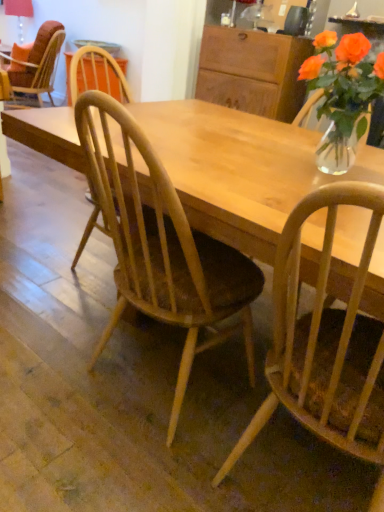
Question: Is the position of wooden cabinet at upper center less distant than that of natural wood chair at center, arranged as the third chair when viewed from the top?

Choices:
 (A) yes
 (B) no

Answer: (B)

Question: Is wooden cabinet at upper center taller than natural wood chair at center, positioned as the first chair in bottom-to-top order?

Choices:
 (A) no
 (B) yes

Answer: (A)

Question: Is wooden cabinet at upper center next to natural wood chair at center, positioned as the first chair in bottom-to-top order?

Choices:
 (A) no
 (B) yes

Answer: (A)

Question: Is wooden cabinet at upper center turned away from natural wood chair at center, positioned as the first chair in bottom-to-top order?

Choices:
 (A) no
 (B) yes

Answer: (A)

Question: Is wooden cabinet at upper center not close to natural wood chair at center, placed as the 3th chair when sorted from left to right?

Choices:
 (A) yes
 (B) no

Answer: (A)

Question: Is natural wood chair at center, positioned as the first chair in bottom-to-top order, inside wooden cabinet at upper center?

Choices:
 (A) no
 (B) yes

Answer: (A)

Question: From a real-world perspective, is light wood chair at center, placed as the 2th chair when sorted from left to right, under natural wood chair at center, placed as the 3th chair when sorted from left to right?

Choices:
 (A) yes
 (B) no

Answer: (B)

Question: Is light wood chair at center, which is the 2th chair in front-to-back order, looking in the opposite direction of natural wood chair at center, placed as the third chair when sorted from back to front?

Choices:
 (A) no
 (B) yes

Answer: (A)

Question: From a real-world perspective, is light wood chair at center, arranged as the 2th chair when viewed from the right, on top of natural wood chair at center, placed as the 3th chair when sorted from left to right?

Choices:
 (A) yes
 (B) no

Answer: (A)

Question: Considering the relative sizes of light wood chair at center, placed as the 2th chair when sorted from left to right, and natural wood chair at center, the 1th chair viewed from the right, in the image provided, is light wood chair at center, placed as the 2th chair when sorted from left to right, thinner than natural wood chair at center, the 1th chair viewed from the right,?

Choices:
 (A) no
 (B) yes

Answer: (B)

Question: Considering the relative sizes of light wood chair at center, which is the 2th chair in front-to-back order, and natural wood chair at center, placed as the third chair when sorted from back to front, in the image provided, is light wood chair at center, which is the 2th chair in front-to-back order, smaller than natural wood chair at center, placed as the third chair when sorted from back to front,?

Choices:
 (A) no
 (B) yes

Answer: (A)

Question: Is natural wood chair at center, placed as the 1th chair when sorted from front to back, inside light wood chair at center, placed as the 2th chair when sorted from left to right?

Choices:
 (A) yes
 (B) no

Answer: (B)

Question: Is translucent glass vase at upper right taller than light wood chair at center, which is the 2th chair in front-to-back order?

Choices:
 (A) no
 (B) yes

Answer: (A)